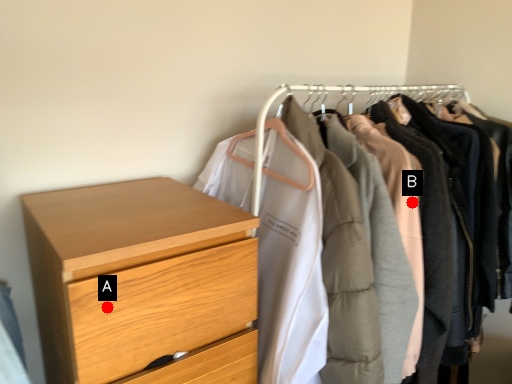
Question: Two points are circled on the image, labeled by A and B beside each circle. Which of the following is the closest to the observer?

Choices:
 (A) A is closer
 (B) B is closer

Answer: (A)